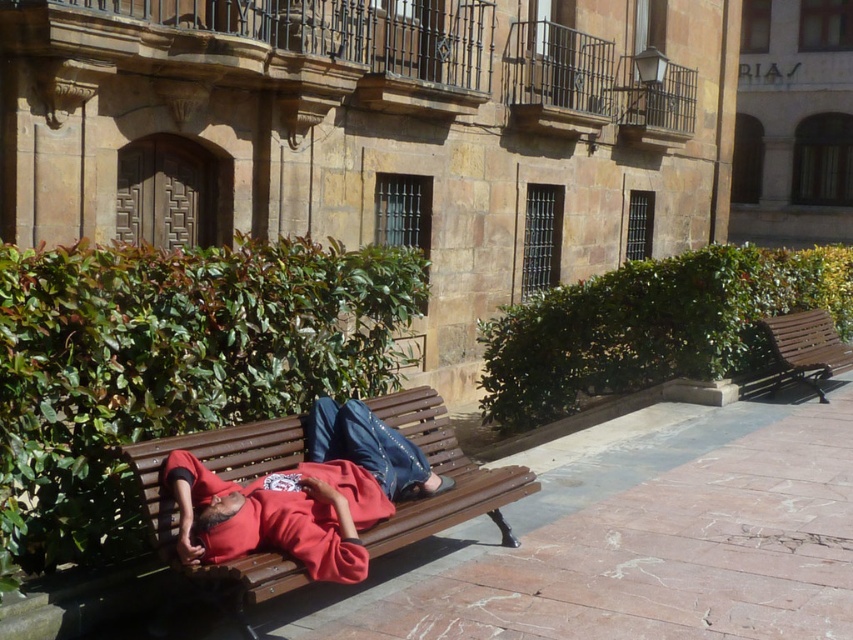
Does brown stone pavement at center lie behind wooden bench at right?

That is False.

Where is `brown stone pavement at center`? The image size is (853, 640). brown stone pavement at center is located at coordinates (643, 544).

Describe the element at coordinates (643, 544) in the screenshot. The height and width of the screenshot is (640, 853). I see `brown stone pavement at center` at that location.

Identify the location of brown stone pavement at center. (643, 544).

Consider the image. Is brown wooden bench at center above wooden bench at right?

No.

Consider the image. Is brown wooden bench at center smaller than wooden bench at right?

Yes, brown wooden bench at center is smaller than wooden bench at right.

The image size is (853, 640). I want to click on brown wooden bench at center, so click(225, 477).

Between point (612, 496) and point (456, 496), which one is positioned in front?

Point (456, 496) is in front.

Can you confirm if brown stone pavement at center is bigger than brown wooden bench at center?

Actually, brown stone pavement at center might be smaller than brown wooden bench at center.

The width and height of the screenshot is (853, 640). Describe the element at coordinates (643, 544) in the screenshot. I see `brown stone pavement at center` at that location.

Find the location of a particular element. The width and height of the screenshot is (853, 640). brown stone pavement at center is located at coordinates (643, 544).